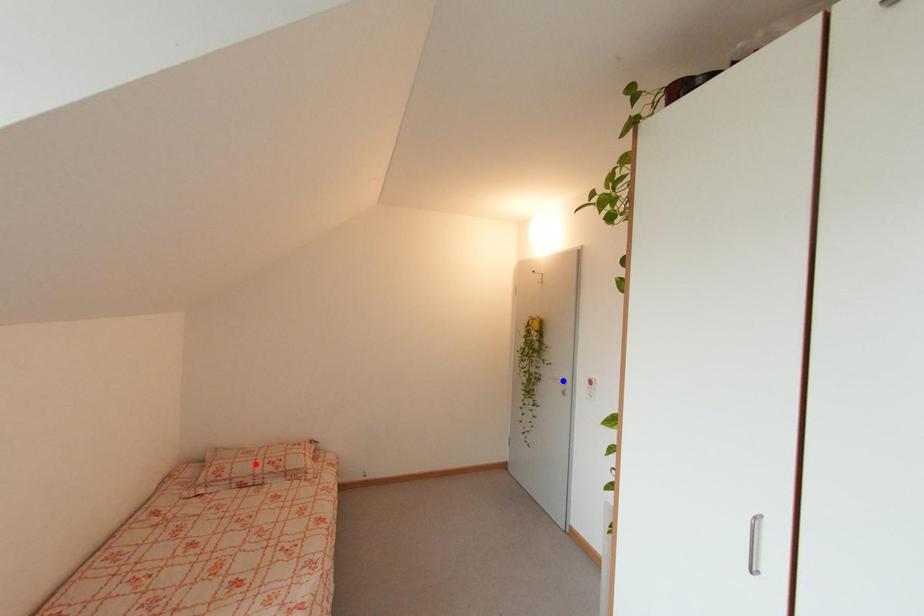
Question: In the image, two points are highlighted. Which point is nearer to the camera? Reply with the corresponding letter.

Choices:
 (A) blue point
 (B) red point

Answer: (B)